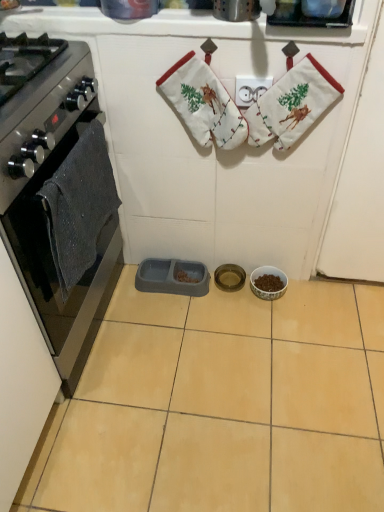
Where is `vacant region above white fabric stocking at upper center (from a real-world perspective)`? The width and height of the screenshot is (384, 512). vacant region above white fabric stocking at upper center (from a real-world perspective) is located at coordinates (299, 49).